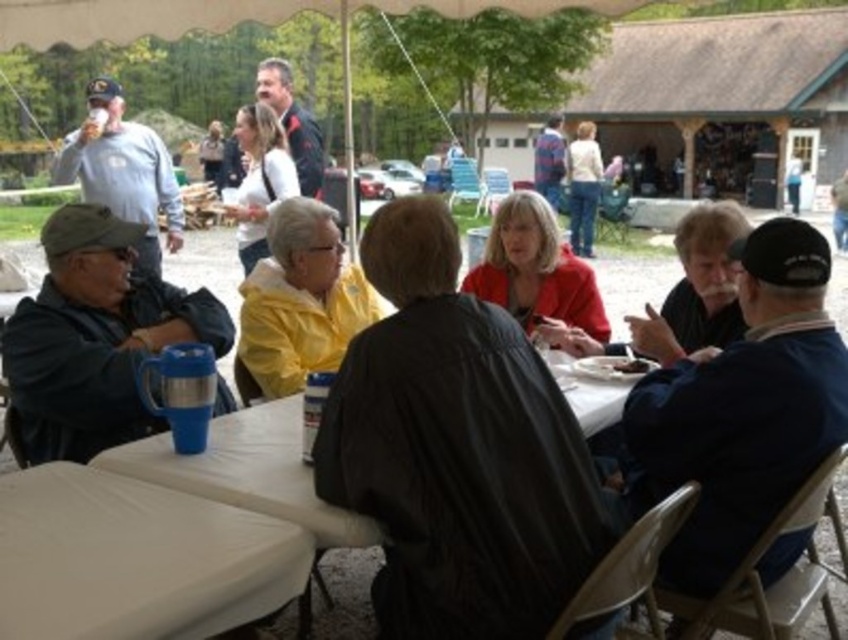
Question: Which point is closer to the camera taking this photo?

Choices:
 (A) (589, 301)
 (B) (249, 246)

Answer: (A)

Question: Is matte black jacket at center further to the viewer compared to white fabric table at center?

Choices:
 (A) yes
 (B) no

Answer: (B)

Question: Which object is farther from the camera taking this photo?

Choices:
 (A) matte black jacket at center
 (B) light beige sweater at upper right
 (C) matte red jacket at center

Answer: (B)

Question: Estimate the real-world distances between objects in this image. Which object is closer to the yellow fabric jacket at upper center?

Choices:
 (A) blue plastic cup at left
 (B) gray fabric jacket at upper left
 (C) light beige sweater at upper right

Answer: (C)

Question: Does blue plastic cup at left have a lesser width compared to white fabric table at center?

Choices:
 (A) yes
 (B) no

Answer: (B)

Question: Can you confirm if matte black jacket at center is thinner than yellow matte jacket at center?

Choices:
 (A) yes
 (B) no

Answer: (B)